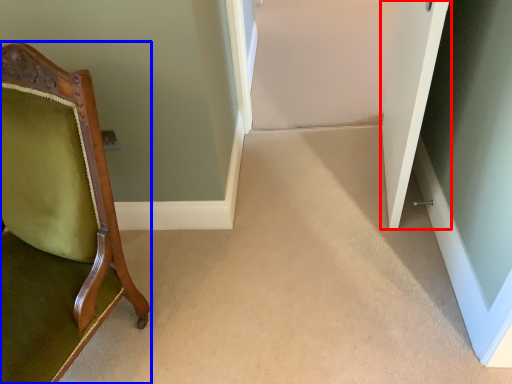
Question: Which object appears closest to the camera in this image, door (highlighted by a red box) or chair (highlighted by a blue box)?

Choices:
 (A) door
 (B) chair

Answer: (B)